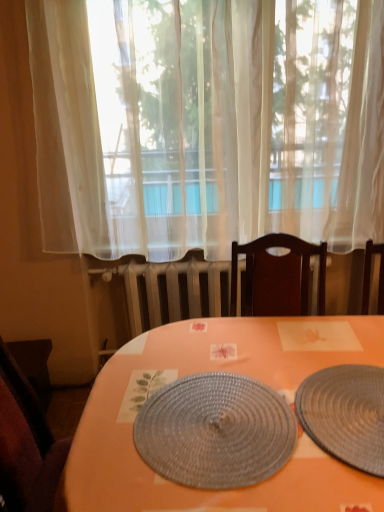
Find the location of a particular element. vacant region under woven gray placemat at center, which is the 2th plate in right-to-left order (from a real-world perspective) is located at coordinates (215, 423).